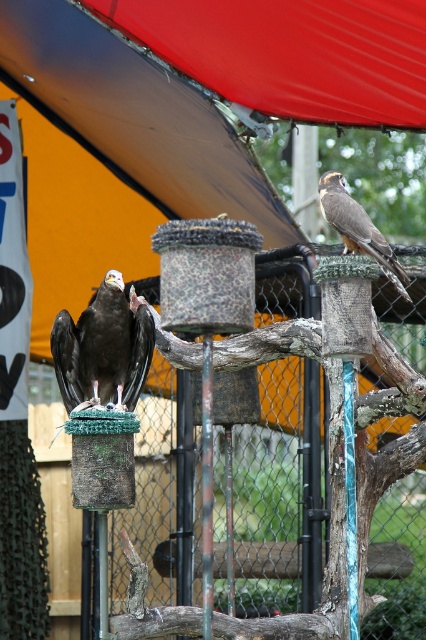
Question: Does dark brown feathers at center appear on the left side of brown feathered eagle at upper right?

Choices:
 (A) yes
 (B) no

Answer: (A)

Question: Which of the following is the closest to the observer?

Choices:
 (A) (348, 241)
 (B) (131, 364)

Answer: (A)

Question: Which point is closer to the camera?

Choices:
 (A) brown feathered eagle at upper right
 (B) dark brown feathers at center

Answer: (A)

Question: Among these points, which one is farthest from the camera?

Choices:
 (A) (339, 196)
 (B) (98, 394)

Answer: (B)

Question: Does dark brown feathers at center appear under brown feathered eagle at upper right?

Choices:
 (A) yes
 (B) no

Answer: (A)

Question: Is dark brown feathers at center thinner than brown feathered eagle at upper right?

Choices:
 (A) no
 (B) yes

Answer: (A)